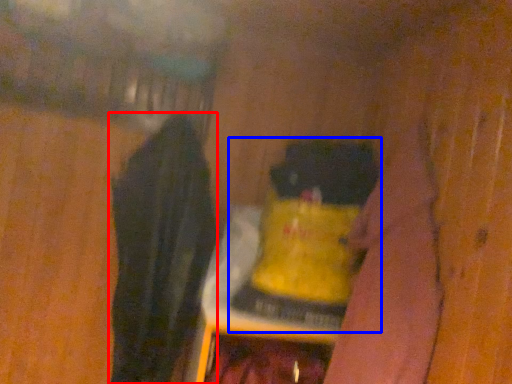
Question: Which of the following is the closest to the observer, clothing (highlighted by a red box) or bottle (highlighted by a blue box)?

Choices:
 (A) clothing
 (B) bottle

Answer: (A)